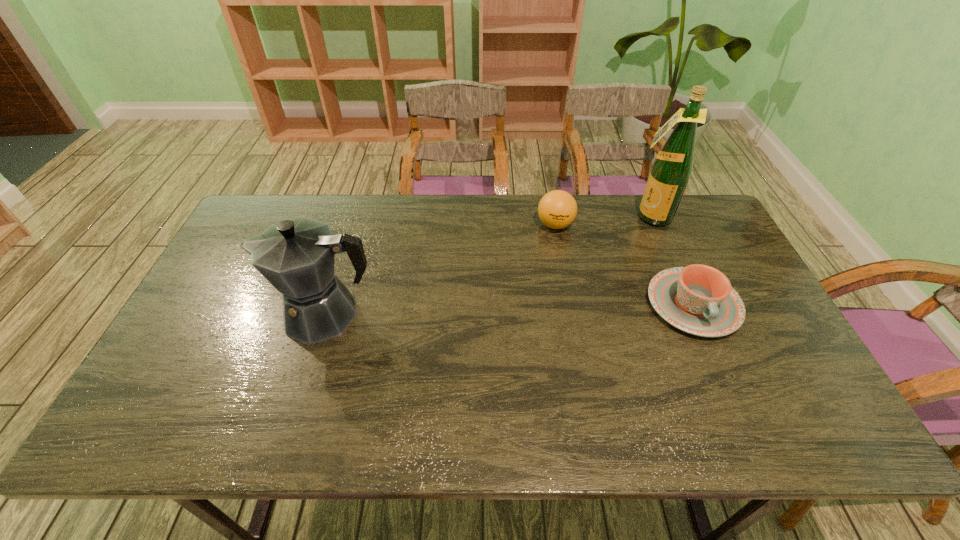
You are a GUI agent. You are given a task and a screenshot of the screen. Output one action in this format:
    pyautogui.click(x=<x>, y=<y>)
    Task: Click on the free spot on the desktop that is between the leftmost object and the chinaware and is positioned on the side with brand of the second object from left to right
    This screenshot has width=960, height=540.
    Given the screenshot: What is the action you would take?
    pyautogui.click(x=516, y=309)

Find the location of a particular element. This screenshot has height=540, width=960. free space on the desktop that is between the coffeepot and the chinaware and is positioned on the front-facing side of the liquor is located at coordinates (563, 308).